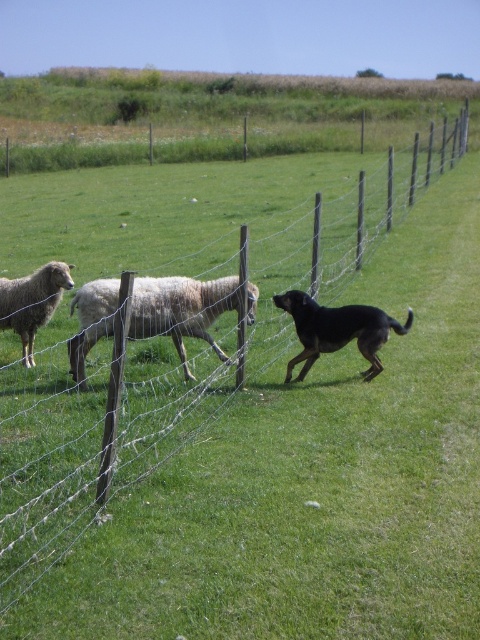
Question: Which of the following is the closest to the observer?

Choices:
 (A) (297, 304)
 (B) (60, 280)
 (C) (228, 276)

Answer: (A)

Question: Is black matte dog at center further to camera compared to white woolly sheep at left?

Choices:
 (A) no
 (B) yes

Answer: (A)

Question: Is black matte dog at center to the right of white woolly sheep at left from the viewer's perspective?

Choices:
 (A) yes
 (B) no

Answer: (A)

Question: Which object appears closest to the camera in this image?

Choices:
 (A) black matte dog at center
 (B) white woolen sheep at center
 (C) white woolly sheep at left

Answer: (A)

Question: Which object is the farthest from the black matte dog at center?

Choices:
 (A) white woolen sheep at center
 (B) white woolly sheep at left

Answer: (B)

Question: Does white woolen sheep at center have a lesser width compared to white woolly sheep at left?

Choices:
 (A) no
 (B) yes

Answer: (A)